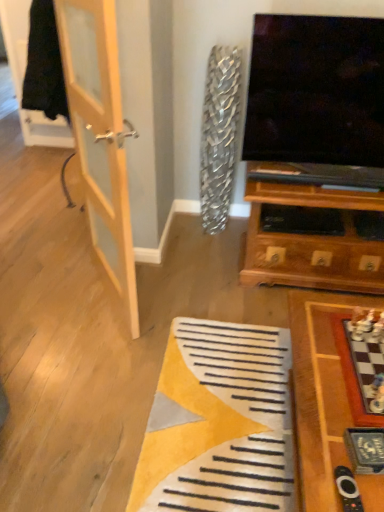
Find the location of a particular element. This screenshot has height=512, width=384. free spot behind black plastic remote at lower right is located at coordinates (327, 439).